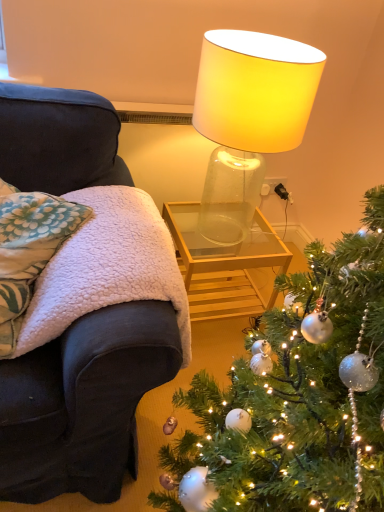
Question: Based on their positions, is white fleece blanket at left located to the left or right of translucent glass lamp at upper center?

Choices:
 (A) left
 (B) right

Answer: (A)

Question: Would you say white fleece blanket at left is inside or outside translucent glass lamp at upper center?

Choices:
 (A) outside
 (B) inside

Answer: (A)

Question: Estimate the real-world distances between objects in this image. Which object is closer to the transparent glass table at center?

Choices:
 (A) translucent glass lamp at upper center
 (B) shiny silver ornaments at lower right
 (C) fluffy white pillow at left
 (D) white fleece blanket at left

Answer: (D)

Question: Based on their relative distances, which object is nearer to the white fleece blanket at left?

Choices:
 (A) transparent glass table at center
 (B) fluffy white pillow at left
 (C) shiny silver ornaments at lower right
 (D) translucent glass lamp at upper center

Answer: (B)